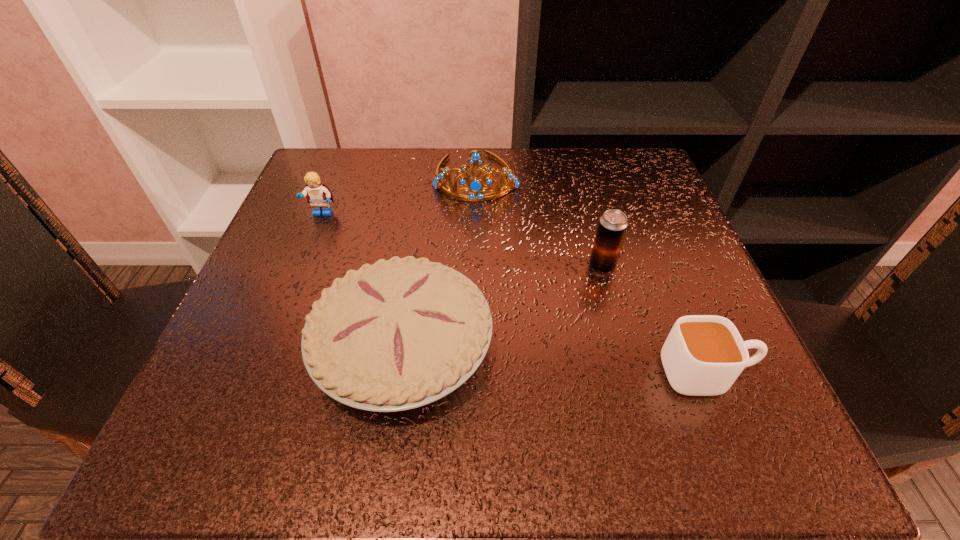
Locate an element on the screen. The image size is (960, 540). object located at the near left corner is located at coordinates (402, 333).

Identify the location of object situated at the near right corner. (703, 355).

Find the location of a particular element. vacant position at the far edge of the desktop is located at coordinates (558, 191).

Identify the location of vacant space at the left edge of the desktop. (313, 220).

Where is `vacant space at the right edge of the desktop`? vacant space at the right edge of the desktop is located at coordinates (665, 293).

The width and height of the screenshot is (960, 540). In the image, there is a desktop. What are the coordinates of `vacant space at the far left corner` in the screenshot? It's located at (372, 186).

The width and height of the screenshot is (960, 540). In the image, there is a desktop. In order to click on vacant space at the near right corner in this screenshot , I will do `click(779, 453)`.

Find the location of a particular element. This screenshot has height=540, width=960. free space between the fourth nearest object and the farthest object is located at coordinates (399, 195).

Locate an element on the screen. Image resolution: width=960 pixels, height=540 pixels. free space that is in between the tiara and the Lego is located at coordinates (399, 195).

You are a GUI agent. You are given a task and a screenshot of the screen. Output one action in this format:
    pyautogui.click(x=<x>, y=<y>)
    Task: Click on the free spot between the tiara and the pie
    
    Given the screenshot: What is the action you would take?
    pyautogui.click(x=440, y=262)